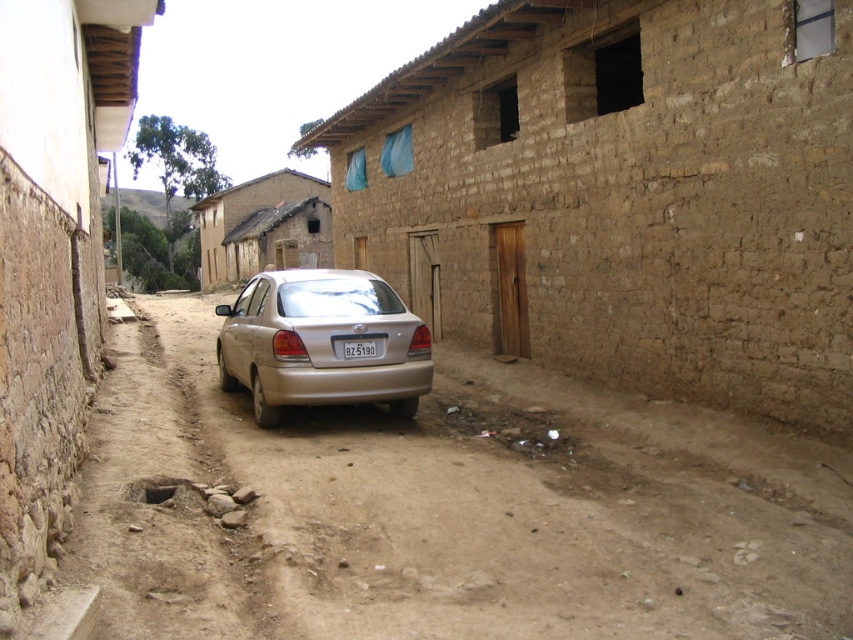
You are standing in the alleyway and want to move from point A to point B. Point A is at coordinate point (265,388) and point B is at coordinate point (350,356). Can you walk directly from point A to point B without going around?

No, you cannot walk directly from point A to point B because point A is behind point B, so you would need to go around.

You are driving a delivery van that is 3.5 meters long and want to navigate through the narrow alleyway. The alleyway has a brown dirt track at center. Can your van fit through the alleyway without going off the track?

A: The brown dirt track at center is 3.65 meters from the camera, which is slightly longer than the van. Since the van is 3.5 meters long, it can fit through the alleyway without going off the track.

In the scene shown: You are driving a car that is 2 meters long. You come across an alleyway and see the brown dirt track at center and the white plastic license plate at center. Can your car fit entirely within the space between them?

The distance between the brown dirt track at center and the white plastic license plate at center is 1.93 meters. Since your car is 2 meters long, it cannot fit entirely within the space between them.